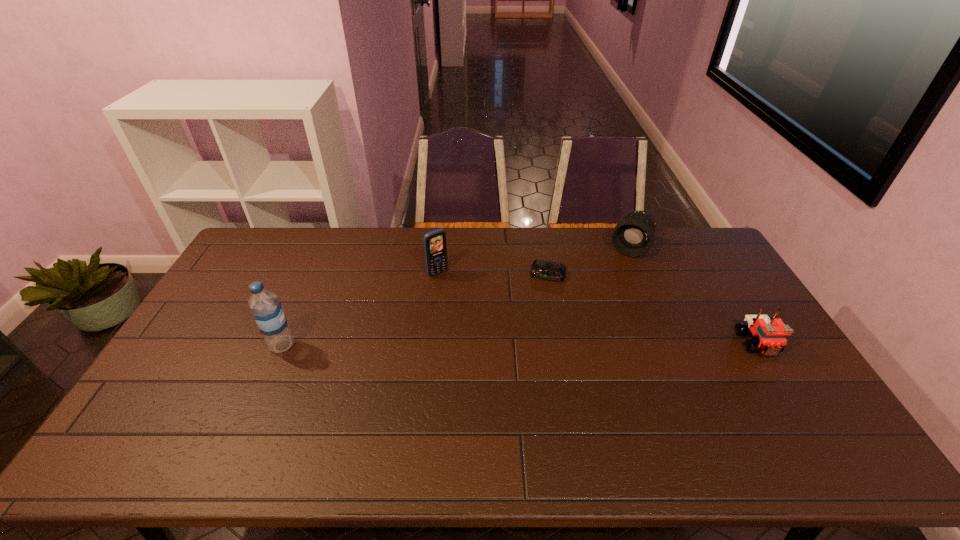
The image size is (960, 540). I want to click on free space on the desktop that is between the water bottle and the second shortest object and is positioned on the display of the third object from right to left, so click(533, 345).

Locate an element on the screen. free space on the desktop that is between the leftmost object and the Lego and is positioned on the screen of the fourth object from right to left is located at coordinates (498, 345).

Locate an element on the screen. Image resolution: width=960 pixels, height=540 pixels. vacant spot on the desktop that is between the tallest object and the Lego and is positioned at the front element of the telephoto lens is located at coordinates (582, 345).